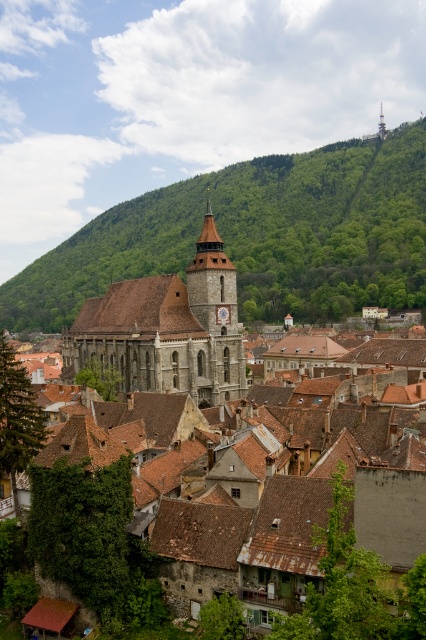
How far apart are brown stone church at center and green leafy hillside at upper center?

brown stone church at center and green leafy hillside at upper center are 173.13 meters apart.

Looking at this image, who is lower down, brown stone church at center or green leafy hillside at upper center?

Positioned lower is brown stone church at center.

Is point (287, 588) in front of point (261, 305)?

Yes, point (287, 588) is closer to viewer.

I want to click on brown stone church at center, so pyautogui.click(x=229, y=451).

Does point (281, 532) come farther from viewer compared to point (154, 355)?

No, it is in front of (154, 355).

Who is higher up, brown stone church at center or dark gray stone church at center?

dark gray stone church at center is higher up.

Locate an element on the screen. This screenshot has width=426, height=640. brown stone church at center is located at coordinates (229, 451).

The height and width of the screenshot is (640, 426). What do you see at coordinates (229, 451) in the screenshot? I see `brown stone church at center` at bounding box center [229, 451].

Who is more distant from viewer, (313, 557) or (233, 312)?

The point (233, 312) is more distant.

Identify the location of brown stone church at center. (229, 451).